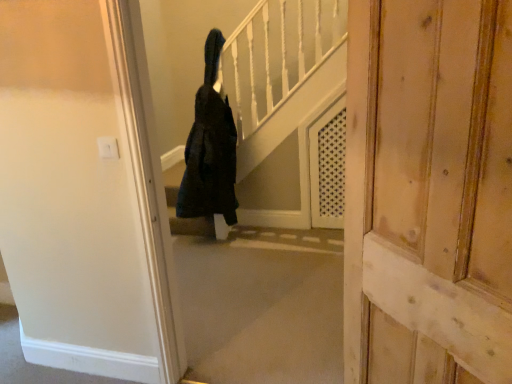
Question: Considering the positions of wooden door at center and black fuzzy coat at center in the image, is wooden door at center bigger or smaller than black fuzzy coat at center?

Choices:
 (A) small
 (B) big

Answer: (B)

Question: Considering the positions of point pos(355,236) and point pos(221,172), is point pos(355,236) closer or farther from the camera than point pos(221,172)?

Choices:
 (A) closer
 (B) farther

Answer: (A)

Question: Considering their positions, is wooden door at center located in front of or behind black fuzzy coat at center?

Choices:
 (A) behind
 (B) front

Answer: (B)

Question: Is black fuzzy coat at center wider or thinner than wooden door at center?

Choices:
 (A) thin
 (B) wide

Answer: (B)

Question: From the image's perspective, is black fuzzy coat at center positioned above or below wooden door at center?

Choices:
 (A) above
 (B) below

Answer: (A)

Question: Is black fuzzy coat at center to the left or to the right of wooden door at center in the image?

Choices:
 (A) right
 (B) left

Answer: (B)

Question: From a real-world perspective, is black fuzzy coat at center physically located above or below wooden door at center?

Choices:
 (A) below
 (B) above

Answer: (A)